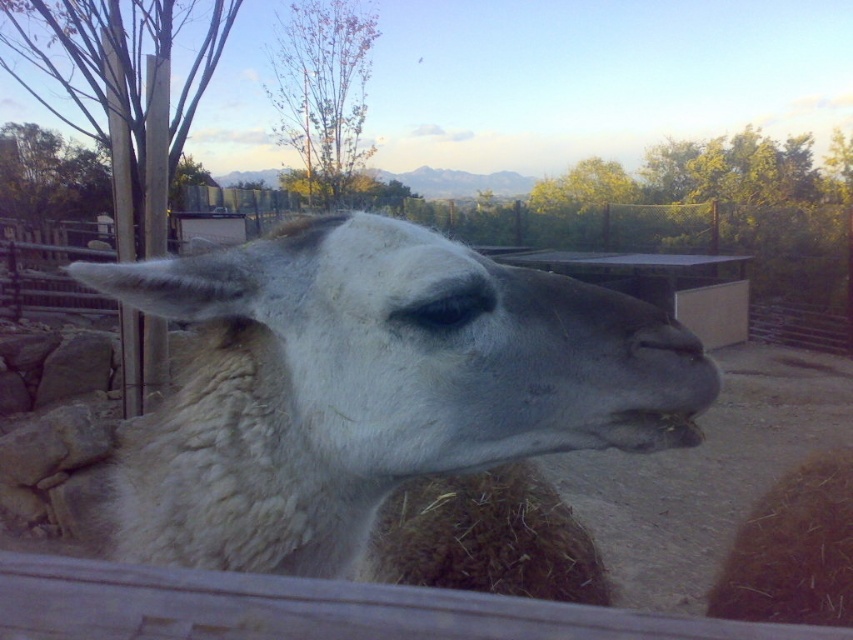
Question: Is white woolen alpaca at center to the left of white woolen nose at center from the viewer's perspective?

Choices:
 (A) no
 (B) yes

Answer: (B)

Question: Can you confirm if white woolen alpaca at center is wider than white woolen nose at center?

Choices:
 (A) yes
 (B) no

Answer: (B)

Question: Which object appears closest to the camera in this image?

Choices:
 (A) white woolen nose at center
 (B) white woolen alpaca at center

Answer: (B)

Question: Is white woolen alpaca at center smaller than white woolen nose at center?

Choices:
 (A) no
 (B) yes

Answer: (B)